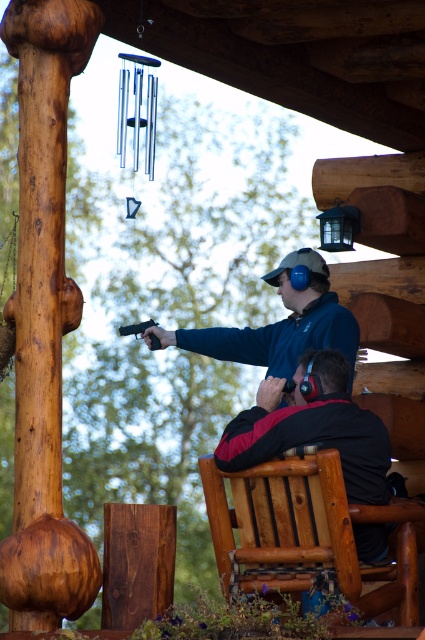
Who is taller, blue matte jacket at center or black plastic gun at center?

With more height is blue matte jacket at center.

Is blue matte jacket at center smaller than black plastic gun at center?

Indeed, blue matte jacket at center has a smaller size compared to black plastic gun at center.

Find the location of a particular element. blue matte jacket at center is located at coordinates (280, 324).

This screenshot has width=425, height=640. I want to click on blue matte jacket at center, so click(x=280, y=324).

Can you confirm if black matte jacket at center is positioned to the right of blue matte jacket at center?

Yes, black matte jacket at center is to the right of blue matte jacket at center.

Does black matte jacket at center have a greater width compared to blue matte jacket at center?

No, black matte jacket at center is not wider than blue matte jacket at center.

Who is more distant from viewer, (356, 449) or (170, 344)?

The point (170, 344) is behind.

You are a GUI agent. You are given a task and a screenshot of the screen. Output one action in this format:
    pyautogui.click(x=<x>, y=<y>)
    Task: Click on the black matte jacket at center
    
    Given the screenshot: What is the action you would take?
    pyautogui.click(x=312, y=428)

Is polished wood post at left further to the viewer compared to blue matte jacket at center?

No.

Looking at this image, is polished wood post at left closer to the viewer compared to blue matte jacket at center?

Yes, polished wood post at left is closer to the viewer.

Is point (36, 180) more distant than point (240, 362)?

No, it is not.

Identify the location of polished wood post at left. The image size is (425, 640). (44, 321).